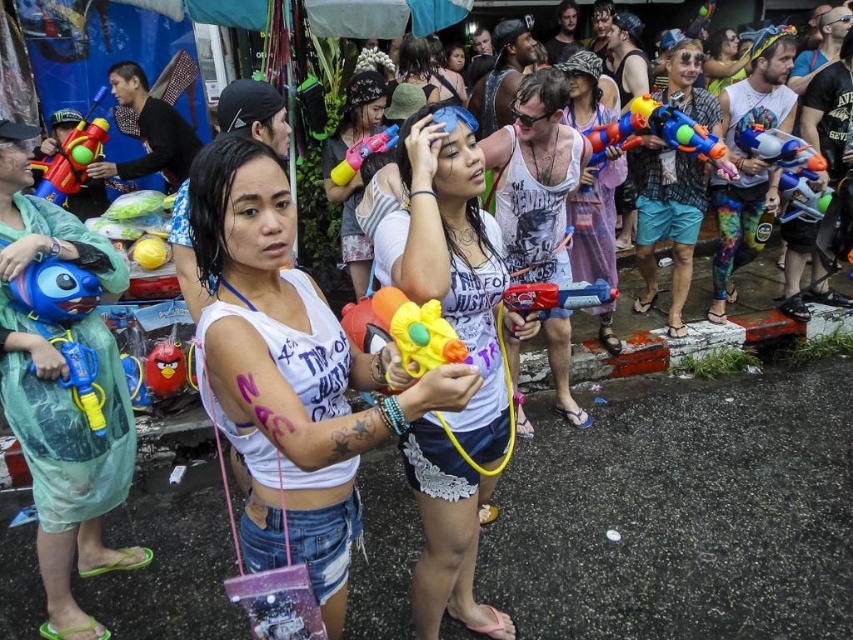
You are a photographer trying to capture a closeup shot of the matte plastic angry bird at center while also including the multicolored plastic water gun at upper right in the frame. Given their distance apart, do you think you can fit both in the same shot without moving your camera position?

The multicolored plastic water gun at upper right and the matte plastic angry bird at center are 9.56 feet apart. Depending on your camera lens and field of view, it might be challenging to capture both in the same frame without moving, as they are over 9 feet apart.

You are a photographer trying to capture the water fight scene. You notice the translucent plastic water gun at right and the matte plastic angry bird at center. Which object should you focus on first if you want to photograph the one closer to the left side of the frame?

The matte plastic angry bird at center is closer to the left side of the frame because the translucent plastic water gun at right is to the right of it.

You are a photographer trying to capture a closeup of the multicolored plastic water gun at upper right and the matte plastic angry bird at center. Which object should you focus on first to ensure both are in focus?

You should focus on the multicolored plastic water gun at upper right first because it is closer to the viewer than the matte plastic angry bird at center. By focusing on the closer object, the background object may still be in focus depending on the depth of field.